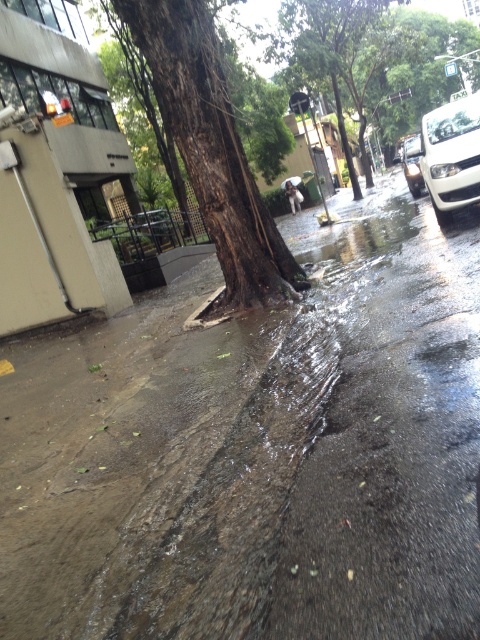
Looking at this image, which of these two, wet asphalt pavement at center or brown rough bark tree at center, stands taller?

brown rough bark tree at center

Is wet asphalt pavement at center smaller than brown rough bark tree at center?

Actually, wet asphalt pavement at center might be larger than brown rough bark tree at center.

Who is more distant from viewer, (434, 225) or (228, 148)?

The point (434, 225) is more distant.

Identify the location of wet asphalt pavement at center. This screenshot has width=480, height=640. (256, 451).

The width and height of the screenshot is (480, 640). Describe the element at coordinates (213, 147) in the screenshot. I see `brown rough bark tree at center` at that location.

Between brown rough bark tree at center and green leafy tree at upper center, which one is positioned lower?

brown rough bark tree at center is below.

Who is more forward, (184, 24) or (286, 6)?

Point (184, 24) is more forward.

Locate an element on the screen. brown rough bark tree at center is located at coordinates (213, 147).

Can you confirm if white glossy car at right is positioned to the left of white glossy car at upper right?

Correct, you'll find white glossy car at right to the left of white glossy car at upper right.

Between point (454, 106) and point (417, 196), which one is positioned in front?

Positioned in front is point (454, 106).

Locate an element on the screen. white glossy car at right is located at coordinates (451, 156).